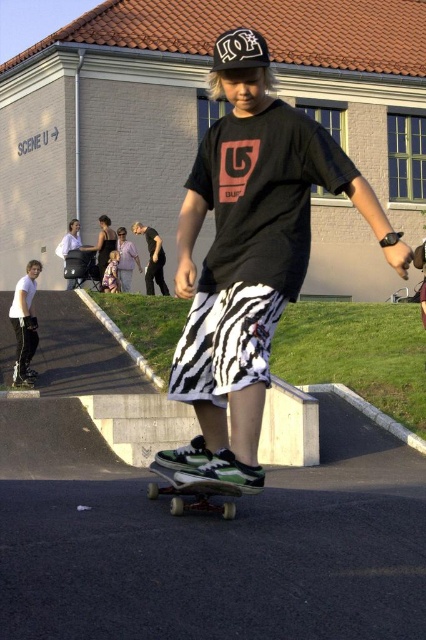
Question: Does white matte pants at lower left appear under green matte skateboard at center?

Choices:
 (A) yes
 (B) no

Answer: (B)

Question: Which point appears closest to the camera in this image?

Choices:
 (A) (218, 93)
 (B) (114, 278)
 (C) (161, 280)

Answer: (A)

Question: Is white matte pants at lower left positioned at the back of black matte pants at center?

Choices:
 (A) yes
 (B) no

Answer: (B)

Question: Is zebra-patterned shorts at center above green matte skateboard at center?

Choices:
 (A) yes
 (B) no

Answer: (A)

Question: Among these objects, which one is farthest from the camera?

Choices:
 (A) zebra-patterned shorts at center
 (B) light purple fabric dress at lower left
 (C) white matte pants at lower left

Answer: (B)

Question: Which object appears closest to the camera in this image?

Choices:
 (A) white matte pants at lower left
 (B) zebra-patterned shorts at center
 (C) black matte pants at center

Answer: (B)